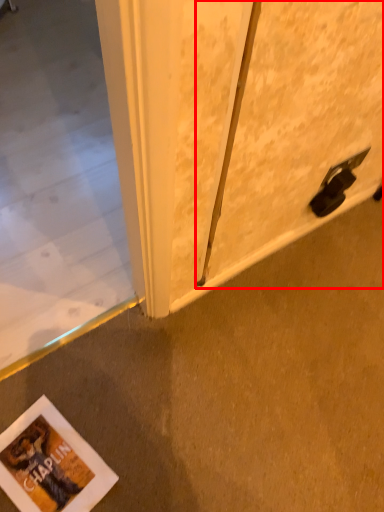
Question: From the image, what is the correct spatial relationship of screen door (annotated by the red box) in relation to concrete?

Choices:
 (A) left
 (B) right

Answer: (B)